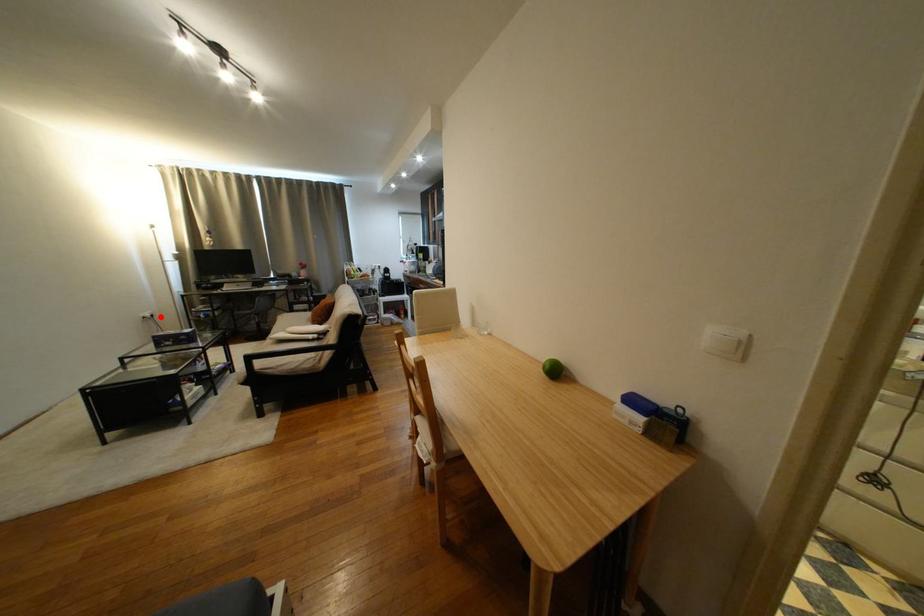
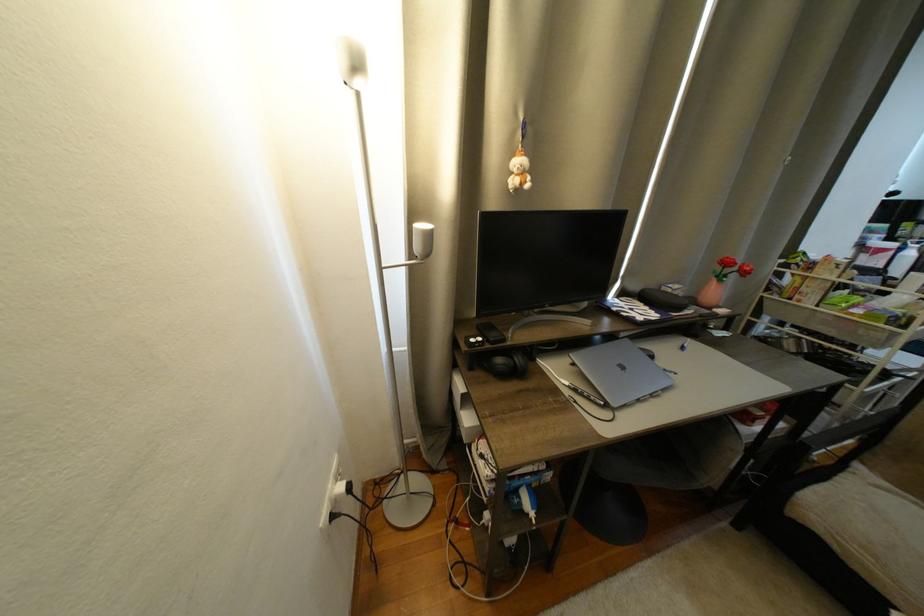
In the second image, find the point that corresponds to the highlighted location in the first image.

(358, 490)